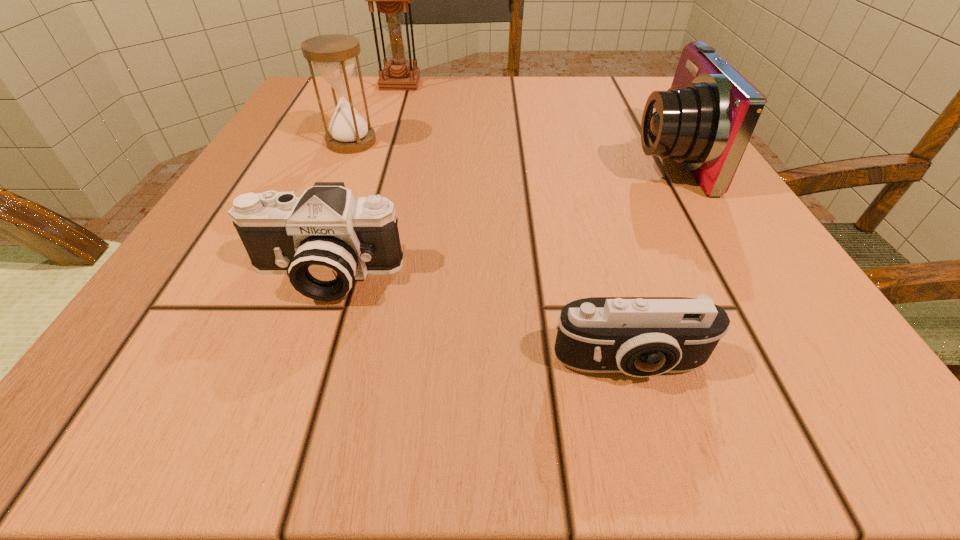
The width and height of the screenshot is (960, 540). I want to click on camera that can be found as the closest to the second shortest camera, so click(x=641, y=337).

Where is `camera that stands as the closest to the nearer hourglass`? Image resolution: width=960 pixels, height=540 pixels. camera that stands as the closest to the nearer hourglass is located at coordinates (324, 240).

Locate an element on the screen. This screenshot has height=540, width=960. free spot that satisfies the following two spatial constraints: 1. on the front-facing side of the rightmost camera; 2. on the front lens of the shortest object is located at coordinates (784, 364).